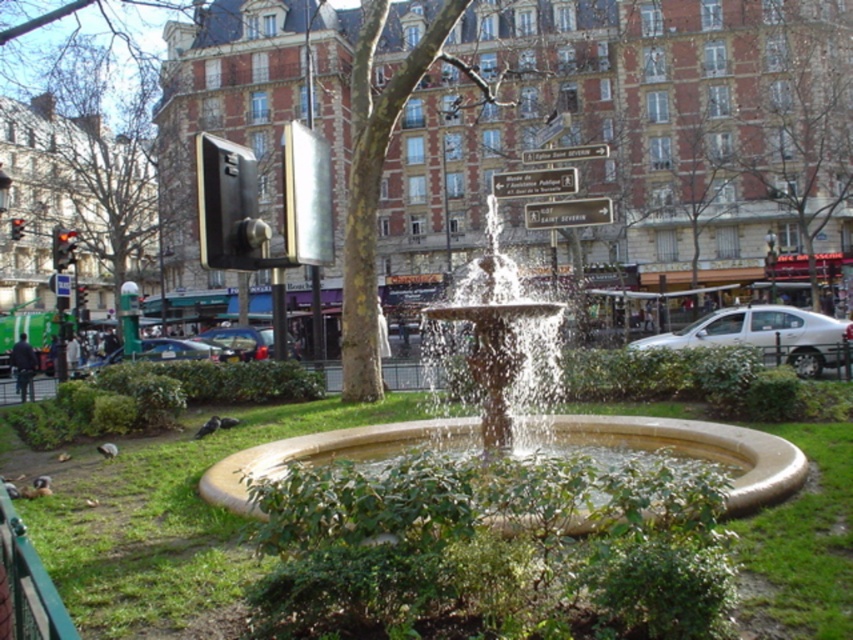
Is bare wood tree at left shorter than brown textured tree at center?

Incorrect, bare wood tree at left's height does not fall short of brown textured tree at center's.

Can you confirm if bare wood tree at left is wider than brown textured tree at center?

Yes.

Is point (32, 266) in front of point (843, 118)?

No.

This screenshot has width=853, height=640. In order to click on bare wood tree at left in this screenshot , I will do `click(83, 172)`.

Between green grass at center and brown textured tree at center, which one has more height?

brown textured tree at center

Does green grass at center have a lesser height compared to brown textured tree at center?

Yes, green grass at center is shorter than brown textured tree at center.

Measure the distance between green grass at center and camera.

green grass at center is 6.38 meters away from camera.

Find the location of `green grass at center`. green grass at center is located at coordinates (160, 516).

Between green grass at center and bare wood tree at left, which one is positioned lower?

Positioned lower is green grass at center.

Between point (195, 508) and point (33, 284), which one is positioned in front?

Point (195, 508) is more forward.

What are the coordinates of `green grass at center` in the screenshot? It's located at (160, 516).

Locate an element on the screen. green grass at center is located at coordinates (160, 516).